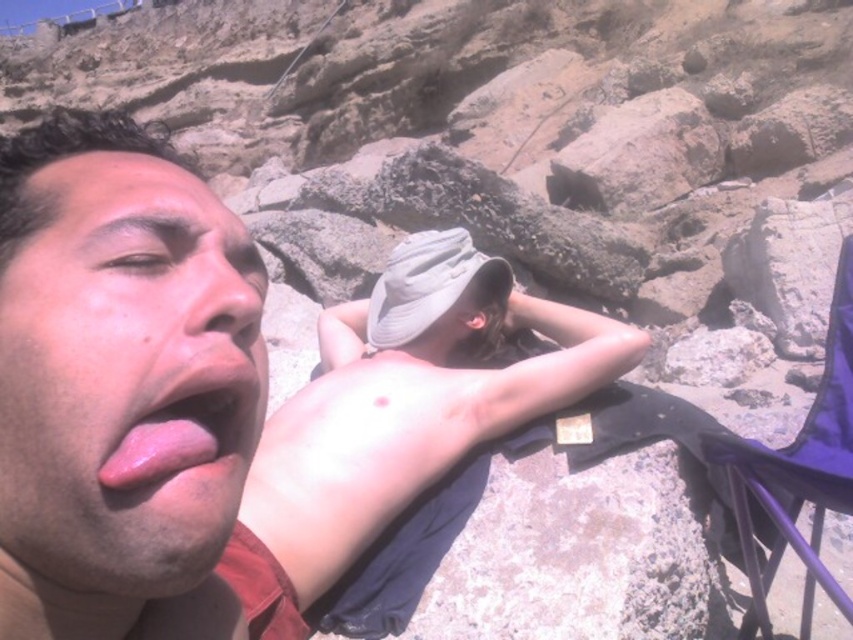
You are a photographer trying to capture a candid shot of the two people in the scene. You notice the smooth tan skin at center and the white fabric baseball hat at center. Which object should you focus on first if you want to capture the person in the foreground?

The smooth tan skin at center is below the white fabric baseball hat at center, so you should focus on the white fabric baseball hat at center first since it is closer to the foreground.

Looking at this image, you are a photographer taking a picture of two people at a rocky beach. You notice the smooth tan skin at center and the white fabric baseball hat at center. Which object is positioned more to the left in the image?

The smooth tan skin at center is positioned more to the left than the white fabric baseball hat at center according to the description.